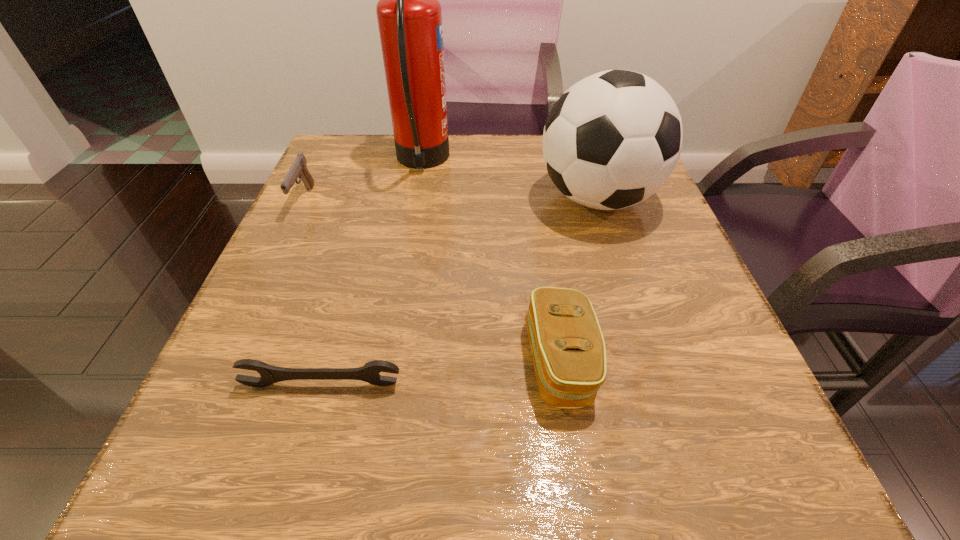
This screenshot has width=960, height=540. I want to click on fire extinguisher, so click(x=409, y=15).

Locate an element on the screen. The height and width of the screenshot is (540, 960). soccer ball is located at coordinates (612, 139).

Locate an element on the screen. the leftmost object is located at coordinates (298, 169).

This screenshot has height=540, width=960. Identify the location of clutch bag. (569, 355).

Find the location of a particular element. The height and width of the screenshot is (540, 960). the shortest object is located at coordinates (370, 371).

Find the location of a particular element. This screenshot has width=960, height=540. free point located on the surface of the tallest object is located at coordinates tap(523, 161).

The height and width of the screenshot is (540, 960). Find the location of `free space located 0.140m on the back of the soccer ball`. free space located 0.140m on the back of the soccer ball is located at coordinates point(578,138).

This screenshot has height=540, width=960. What are the coordinates of `free space located at the barrel of the pistol` in the screenshot? It's located at (287, 235).

Locate an element on the screen. The image size is (960, 540). free region located 0.260m on the zipper side of the clutch bag is located at coordinates (352, 362).

The width and height of the screenshot is (960, 540). Find the location of `free spot located on the zipper side of the clutch bag`. free spot located on the zipper side of the clutch bag is located at coordinates (305, 362).